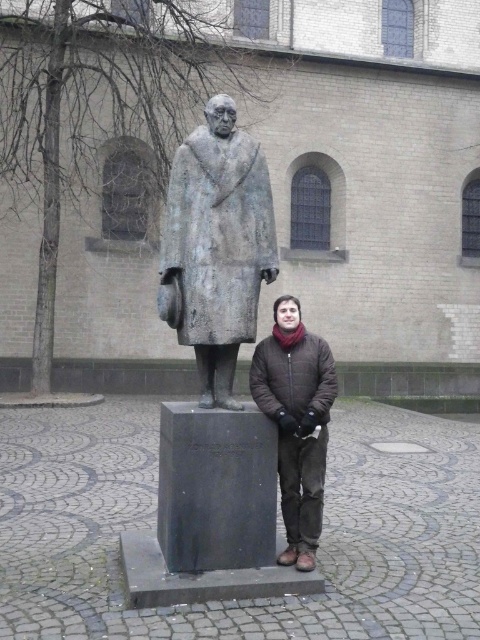
Does bronze statue at center have a lesser width compared to brown quilted jacket at center?

No, bronze statue at center is not thinner than brown quilted jacket at center.

Does bronze statue at center lie behind brown quilted jacket at center?

No.

Locate an element on the screen. The image size is (480, 640). bronze statue at center is located at coordinates (218, 244).